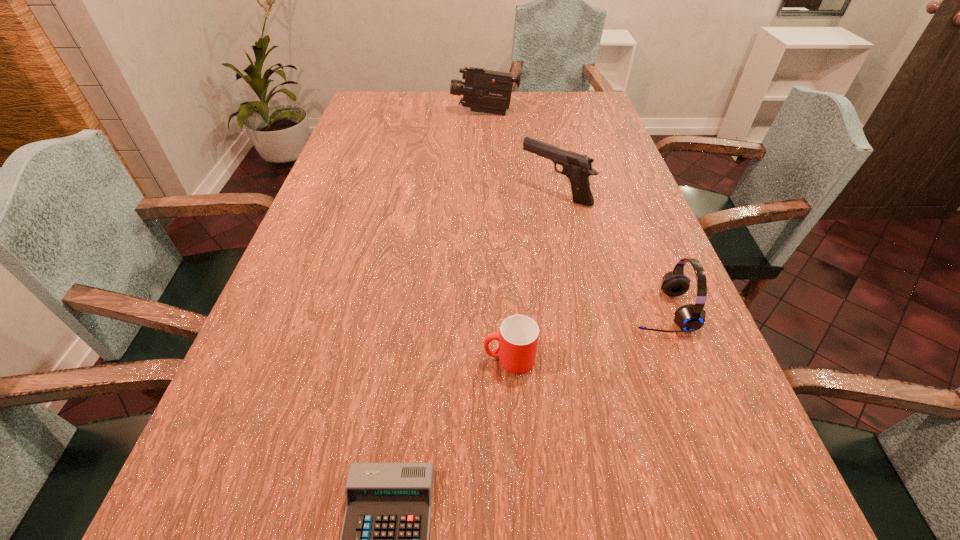
Find the location of a particular element. vacant space located 0.300m at the muzzle of the second farthest object is located at coordinates (413, 193).

Where is `vacant region located at the muzzle of the second farthest object`? vacant region located at the muzzle of the second farthest object is located at coordinates (380, 193).

Image resolution: width=960 pixels, height=540 pixels. What are the coordinates of `vacant space located 0.180m on the ear cushions of the headset` in the screenshot? It's located at (542, 311).

The image size is (960, 540). I want to click on free spot located on the ear cushions of the headset, so click(x=571, y=311).

Where is `vacant area situated 0.250m on the ear cushions of the headset`? The width and height of the screenshot is (960, 540). vacant area situated 0.250m on the ear cushions of the headset is located at coordinates (509, 311).

Identify the location of free region located 0.210m on the side of the fourth tallest object with the handle. This screenshot has width=960, height=540. (372, 359).

Where is `vacant area situated on the side of the fourth tallest object with the handle`? This screenshot has width=960, height=540. vacant area situated on the side of the fourth tallest object with the handle is located at coordinates (356, 359).

Image resolution: width=960 pixels, height=540 pixels. Identify the location of vacant position located on the side of the fourth tallest object with the handle. (394, 359).

Identify the location of object located at the far edge. (486, 91).

The image size is (960, 540). I want to click on gun that is at the right edge, so click(x=577, y=167).